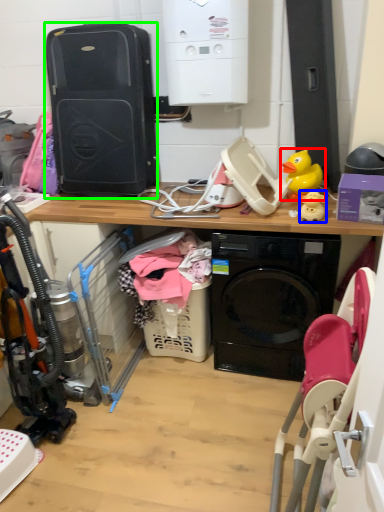
Question: Estimate the real-world distances between objects in this image. Which object is farther from toy (highlighted by a red box), toy (highlighted by a blue box) or computer tower (highlighted by a green box)?

Choices:
 (A) toy
 (B) computer tower

Answer: (B)